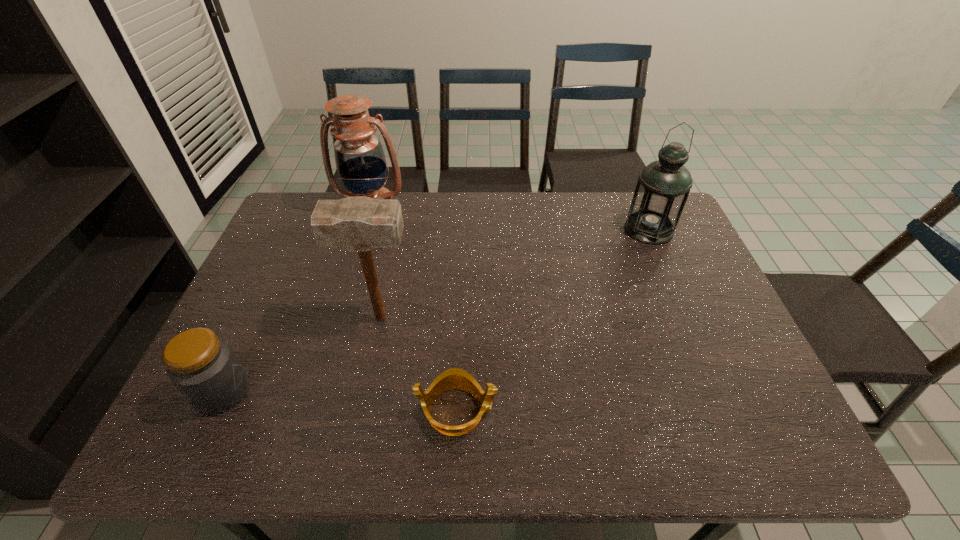
Identify the location of the left oil lamp. (359, 155).

The width and height of the screenshot is (960, 540). In order to click on the rightmost object in this screenshot , I will do `click(663, 186)`.

Locate an element on the screen. This screenshot has width=960, height=540. mallet is located at coordinates (362, 224).

In order to click on jar in this screenshot , I will do `click(203, 367)`.

I want to click on the leftmost object, so click(x=203, y=367).

Identify the location of tiara. 455,378.

Find the location of `the fourth object from left to right`. the fourth object from left to right is located at coordinates (455, 378).

Locate an element on the screen. The height and width of the screenshot is (540, 960). blank area located 0.360m on the right of the left oil lamp is located at coordinates (512, 210).

I want to click on vacant space positioned on the left of the rightmost object, so click(532, 230).

Identify the location of free location located 0.370m on the striking face of the third nearest object. (555, 318).